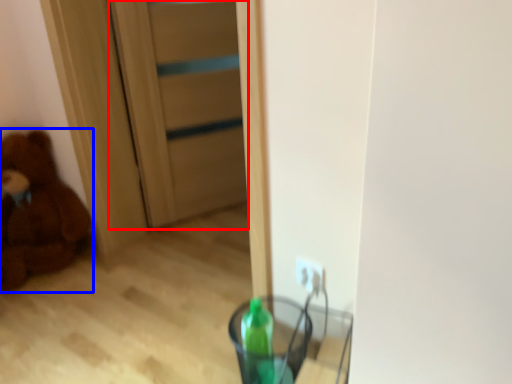
Question: Which of the following is the closest to the observer, door (highlighted by a red box) or teddy bear (highlighted by a blue box)?

Choices:
 (A) door
 (B) teddy bear

Answer: (B)